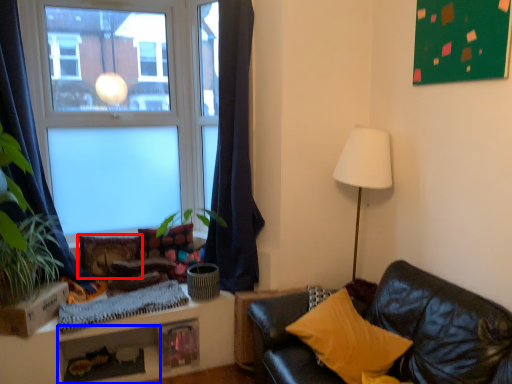
Question: Which object is closer to the camera taking this photo, pillow (highlighted by a red box) or shelf (highlighted by a blue box)?

Choices:
 (A) pillow
 (B) shelf

Answer: (B)